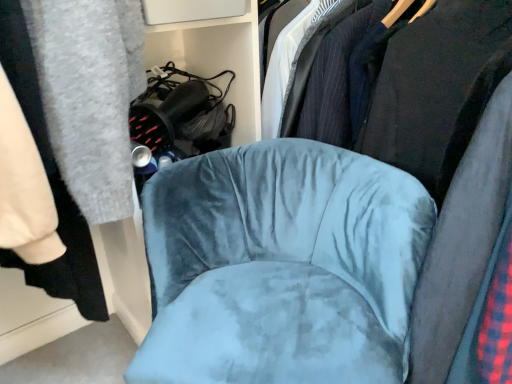
Question: From a real-world perspective, is velvet blue chair at center located beneath velvet blue chair at center?

Choices:
 (A) yes
 (B) no

Answer: (A)

Question: Is velvet blue chair at center facing towards velvet blue chair at center?

Choices:
 (A) no
 (B) yes

Answer: (A)

Question: Considering the relative sizes of velvet blue chair at center and velvet blue chair at center in the image provided, is velvet blue chair at center smaller than velvet blue chair at center?

Choices:
 (A) yes
 (B) no

Answer: (A)

Question: Is velvet blue chair at center bigger than velvet blue chair at center?

Choices:
 (A) no
 (B) yes

Answer: (A)

Question: From the image's perspective, is velvet blue chair at center located beneath velvet blue chair at center?

Choices:
 (A) yes
 (B) no

Answer: (A)

Question: From a real-world perspective, is velvet blue chair at center physically above velvet blue chair at center?

Choices:
 (A) no
 (B) yes

Answer: (A)

Question: Is the depth of velvet blue chair at center greater than that of velvet black bookshelf at upper center?

Choices:
 (A) yes
 (B) no

Answer: (B)

Question: Is velvet blue chair at center closer to camera compared to velvet black bookshelf at upper center?

Choices:
 (A) yes
 (B) no

Answer: (A)

Question: Can you confirm if velvet blue chair at center is shorter than velvet black bookshelf at upper center?

Choices:
 (A) no
 (B) yes

Answer: (A)

Question: Does velvet blue chair at center have a greater width compared to velvet black bookshelf at upper center?

Choices:
 (A) no
 (B) yes

Answer: (B)

Question: Does velvet blue chair at center have a lesser width compared to velvet black bookshelf at upper center?

Choices:
 (A) yes
 (B) no

Answer: (B)

Question: From a real-world perspective, is velvet blue chair at center over velvet black bookshelf at upper center?

Choices:
 (A) no
 (B) yes

Answer: (A)

Question: From a real-world perspective, is velvet blue chair at center physically below velvet black bookshelf at upper center?

Choices:
 (A) yes
 (B) no

Answer: (B)